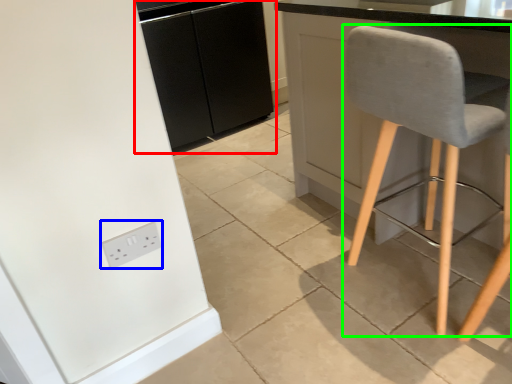
Question: Which is farther away from cabinetry (highlighted by a red box)? socket (highlighted by a blue box) or chair (highlighted by a green box)?

Choices:
 (A) socket
 (B) chair

Answer: (A)